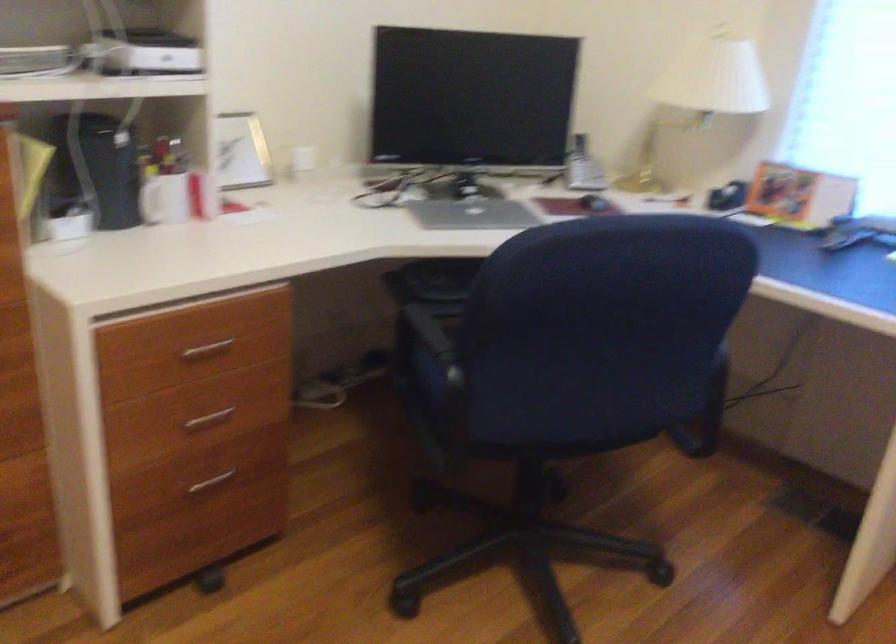
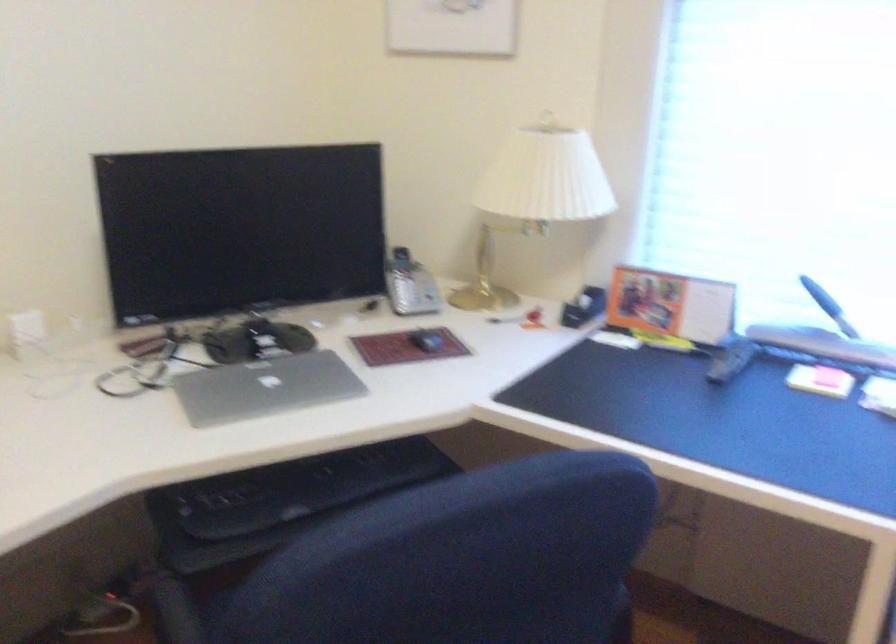
In the second image, find the point that corresponds to the point at 803,194 in the first image.

(670, 305)